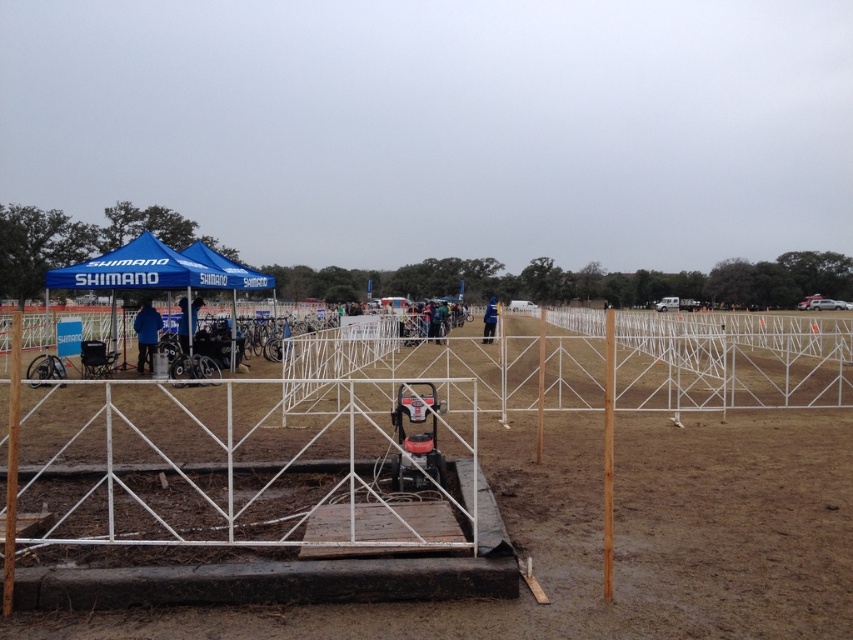
Question: Among these points, which one is nearest to the camera?

Choices:
 (A) (184, 326)
 (B) (397, 388)
 (C) (143, 273)

Answer: (B)

Question: Among these objects, which one is nearest to the camera?

Choices:
 (A) blue fabric tent at left
 (B) blue fabric jacket at center

Answer: (A)

Question: Does blue fabric canopy at left lie in front of blue fabric tent at left?

Choices:
 (A) no
 (B) yes

Answer: (B)

Question: Estimate the real-world distances between objects in this image. Which object is farther from the blue fabric canopy at left?

Choices:
 (A) brown dirt field at center
 (B) blue fabric canopy at upper left
 (C) red plastic generator at center

Answer: (C)

Question: Does blue fabric canopy at upper left appear under blue fabric tent at left?

Choices:
 (A) no
 (B) yes

Answer: (A)

Question: Is brown dirt field at center to the left of blue fabric tent at left from the viewer's perspective?

Choices:
 (A) no
 (B) yes

Answer: (A)